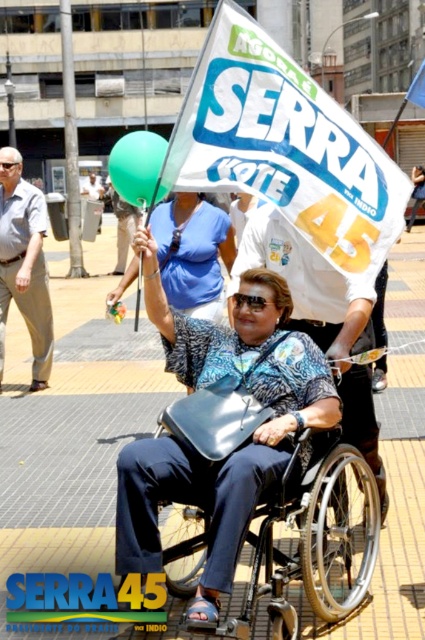
Locate an element on the screen. This screenshot has width=425, height=640. matte blue shirt at center is located at coordinates (240, 445).

Can you confirm if matte blue shirt at center is positioned below blue printed shirt at center?

Indeed, matte blue shirt at center is positioned under blue printed shirt at center.

At what (x,y) coordinates should I click in order to perform the action: click on matte blue shirt at center. Please return your answer as a coordinate pair (x, y). The image size is (425, 640). Looking at the image, I should click on pyautogui.click(x=240, y=445).

Does black leather wheelchair at center have a larger size compared to green rubber balloon at upper center?

No.

Who is shorter, black leather wheelchair at center or green rubber balloon at upper center?

black leather wheelchair at center is shorter.

Does point (294, 518) come in front of point (159, 164)?

Yes.

I want to click on black leather wheelchair at center, so click(x=311, y=540).

Does black leather wheelchair at center have a smaller size compared to black plastic goggles at upper center?

Incorrect, black leather wheelchair at center is not smaller in size than black plastic goggles at upper center.

Is point (240, 438) positioned in front of point (0, 161)?

Yes, it is in front of point (0, 161).

Find the location of a particular element. The height and width of the screenshot is (640, 425). black leather wheelchair at center is located at coordinates (311, 540).